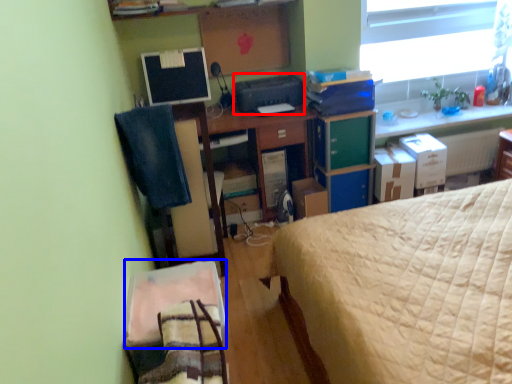
Question: Among these objects, which one is farthest to the camera, printer (highlighted by a red box) or sheet (highlighted by a blue box)?

Choices:
 (A) printer
 (B) sheet

Answer: (A)